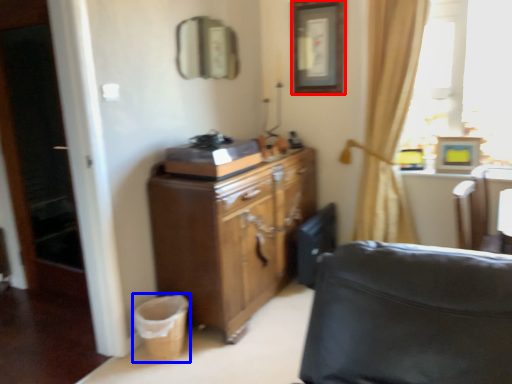
Question: Which point is further to the camera, picture frame (highlighted by a red box) or laundry basket (highlighted by a blue box)?

Choices:
 (A) picture frame
 (B) laundry basket

Answer: (A)